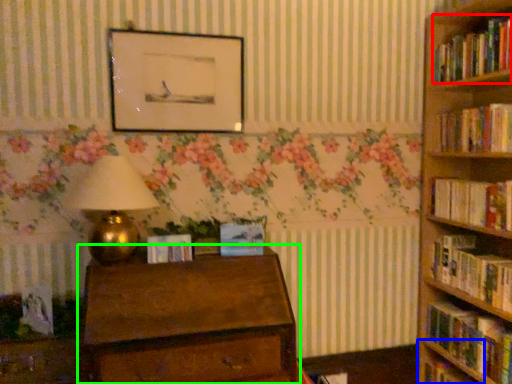
Question: Based on their relative distances, which object is nearer to book (highlighted by a red box)? Choose from shelf (highlighted by a blue box) and chest of drawers (highlighted by a green box).

Choices:
 (A) shelf
 (B) chest of drawers

Answer: (A)